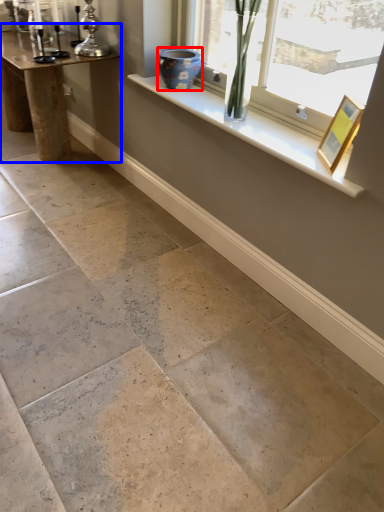
Question: Among these objects, which one is farthest to the camera, vase (highlighted by a red box) or table (highlighted by a blue box)?

Choices:
 (A) vase
 (B) table

Answer: (B)